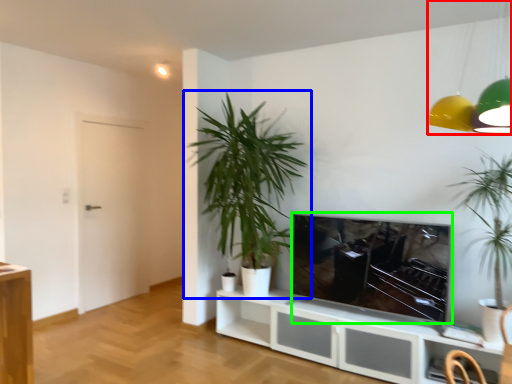
Question: Which object is the closest to the lamp (highlighted by a red box)? Choose among these: houseplant (highlighted by a blue box) or television (highlighted by a green box).

Choices:
 (A) houseplant
 (B) television

Answer: (B)